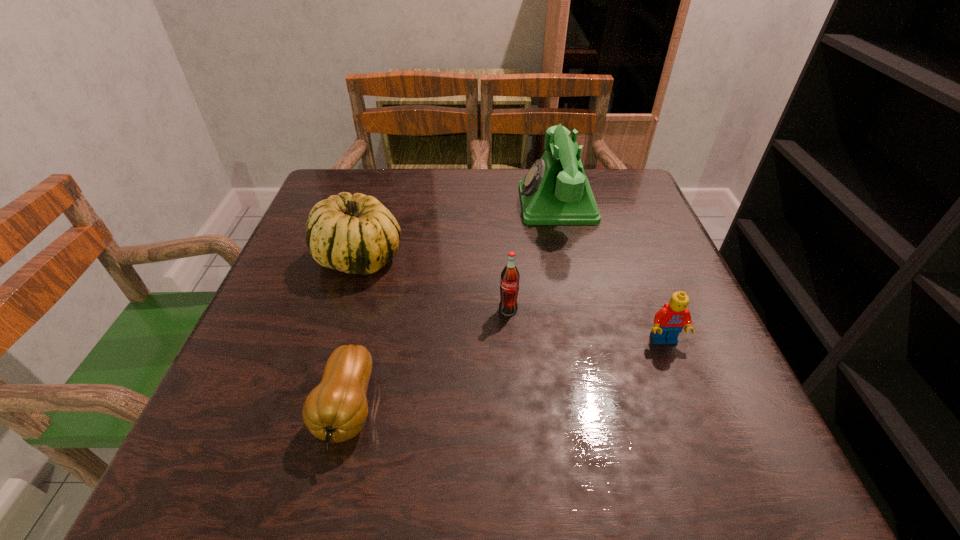
Where is `vacant region located on the dial of the tallest object`? The width and height of the screenshot is (960, 540). vacant region located on the dial of the tallest object is located at coordinates (441, 204).

Where is `free spot located 0.370m on the dial of the tallest object`? The height and width of the screenshot is (540, 960). free spot located 0.370m on the dial of the tallest object is located at coordinates (373, 204).

Image resolution: width=960 pixels, height=540 pixels. I want to click on free space located 0.270m on the front of the taller gourd, so click(313, 406).

Where is `free spot located 0.160m on the label of the third object from right to left`? free spot located 0.160m on the label of the third object from right to left is located at coordinates click(513, 389).

Identify the location of vacant space located 0.150m on the face of the fourth tallest object. The height and width of the screenshot is (540, 960). (698, 428).

Where is `object that is at the far edge`? The width and height of the screenshot is (960, 540). object that is at the far edge is located at coordinates (555, 191).

Find the location of a particular element. The image size is (960, 540). object that is at the near edge is located at coordinates (336, 410).

At what (x,y) coordinates should I click in order to perform the action: click on object located at the left edge. Please return your answer as a coordinate pair (x, y). The image size is (960, 540). Looking at the image, I should click on (356, 234).

At what (x,y) coordinates should I click in order to perform the action: click on telephone that is at the right edge. Please return your answer as a coordinate pair (x, y). The height and width of the screenshot is (540, 960). Looking at the image, I should click on (555, 191).

Locate an element on the screen. The image size is (960, 540). Lego that is at the right edge is located at coordinates (669, 321).